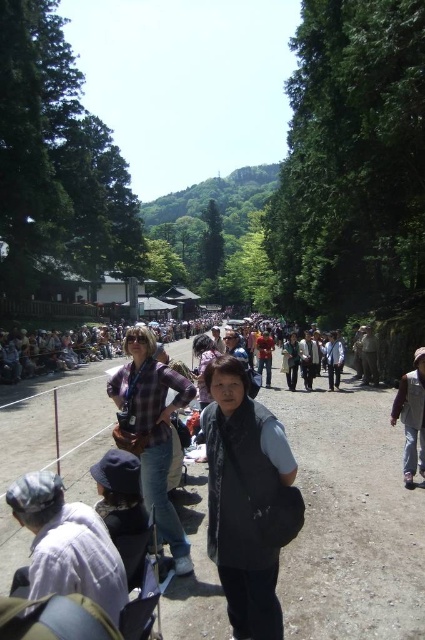
Question: Based on their relative distances, which object is nearer to the black fabric vest at center?

Choices:
 (A) light gray fabric hat at lower left
 (B) brown dirt track at center

Answer: (A)

Question: Is brown dirt track at center wider than black fabric vest at center?

Choices:
 (A) yes
 (B) no

Answer: (A)

Question: Which of the following is the closest to the observer?

Choices:
 (A) brown dirt track at center
 (B) light gray fabric hat at lower left

Answer: (B)

Question: Is black fabric vest at center to the right of light gray fabric hat at lower left from the viewer's perspective?

Choices:
 (A) yes
 (B) no

Answer: (A)

Question: Which of the following is the farthest from the observer?

Choices:
 (A) black fabric vest at center
 (B) brown dirt track at center
 (C) light gray fabric hat at lower left

Answer: (A)

Question: Does brown dirt track at center have a larger size compared to light gray fabric hat at lower left?

Choices:
 (A) no
 (B) yes

Answer: (B)